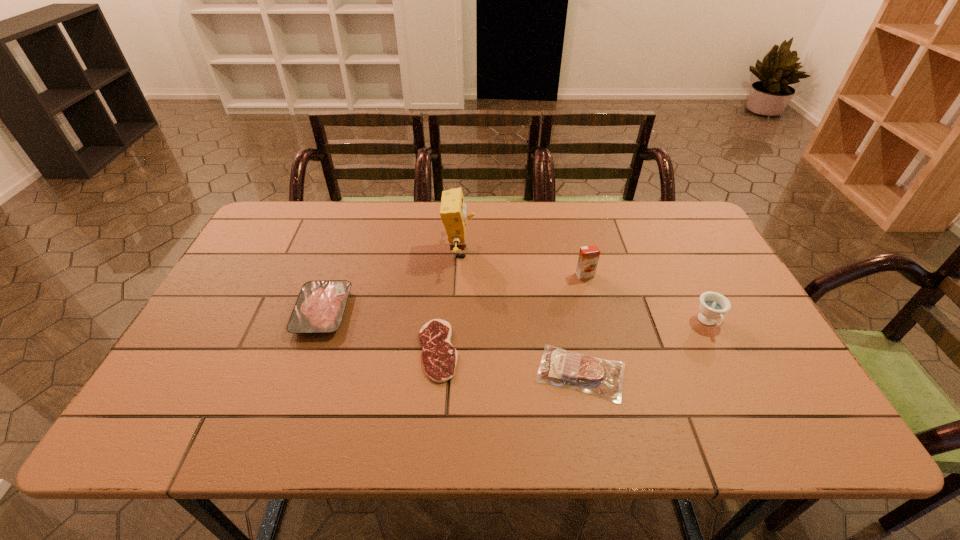
Locate an element on the screen. The image size is (960, 540). sponge is located at coordinates (453, 210).

The width and height of the screenshot is (960, 540). I want to click on the fifth shortest object, so pyautogui.click(x=588, y=257).

The image size is (960, 540). In order to click on the third tallest object in this screenshot , I will do `click(713, 305)`.

The width and height of the screenshot is (960, 540). I want to click on teacup, so click(713, 305).

At what (x,y) coordinates should I click in order to perform the action: click on the leftmost steak. Please return your answer as a coordinate pair (x, y). Image resolution: width=960 pixels, height=540 pixels. Looking at the image, I should click on tap(320, 306).

At what (x,y) coordinates should I click in order to perform the action: click on the rightmost steak. Please return your answer as a coordinate pair (x, y). This screenshot has width=960, height=540. Looking at the image, I should click on (603, 378).

Image resolution: width=960 pixels, height=540 pixels. I want to click on the shortest steak, so click(439, 357).

The width and height of the screenshot is (960, 540). I want to click on the second steak from right to left, so click(x=439, y=357).

Identify the location of vacant space located on the face of the tallest object. The width and height of the screenshot is (960, 540). (508, 252).

Locate an element on the screen. This screenshot has height=540, width=960. vacant position located on the right of the orange juice is located at coordinates (663, 275).